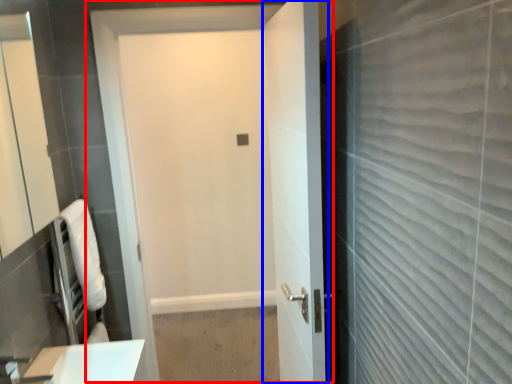
Question: Which object is further to the camera taking this photo, door (highlighted by a red box) or door (highlighted by a blue box)?

Choices:
 (A) door
 (B) door

Answer: (A)